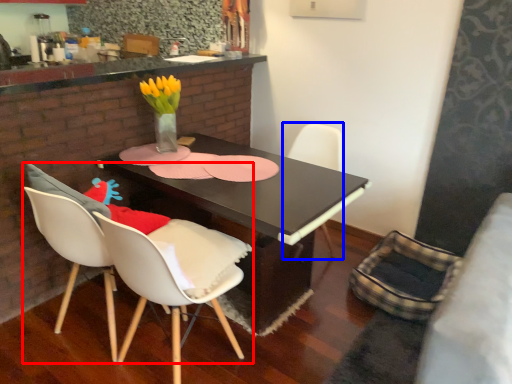
Question: Which point is closer to the camera, chair (highlighted by a red box) or chair (highlighted by a blue box)?

Choices:
 (A) chair
 (B) chair

Answer: (A)